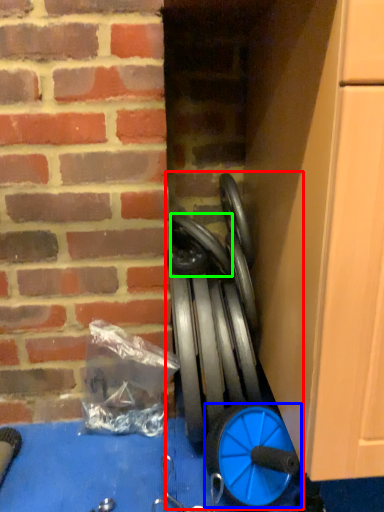
Question: Based on their relative distances, which object is nearer to sport equipment (highlighted by a red box)? Choose from wheel (highlighted by a blue box) and car tire (highlighted by a green box).

Choices:
 (A) wheel
 (B) car tire

Answer: (A)